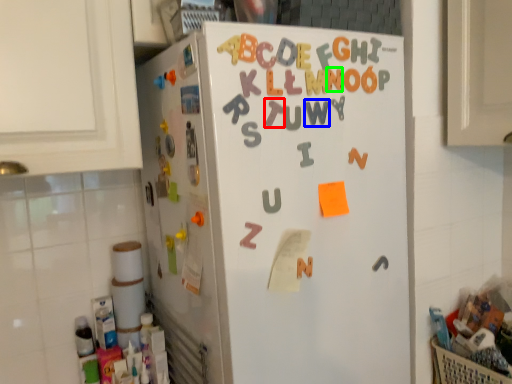
Question: Based on their relative distances, which object is nearer to letter (highlighted by a red box)? Choose from letter (highlighted by a blue box) and letter (highlighted by a green box).

Choices:
 (A) letter
 (B) letter

Answer: (A)